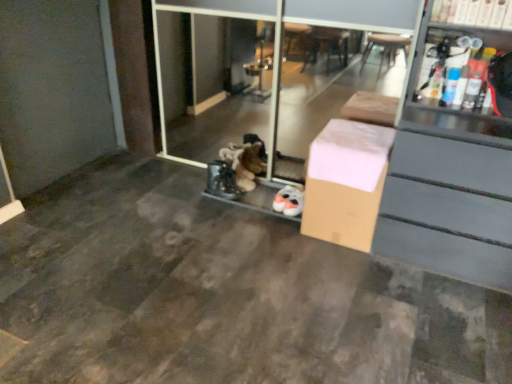
What do you see at coordinates (274, 70) in the screenshot? This screenshot has width=512, height=384. I see `transparent glass screen door at center` at bounding box center [274, 70].

I want to click on white cardboard box at upper right, so click(x=474, y=13).

Is transparent glass screen door at center placed right next to brown cardboard box at center?

No, transparent glass screen door at center is not with brown cardboard box at center.

Considering the relative sizes of transparent glass screen door at center and brown cardboard box at center in the image provided, is transparent glass screen door at center shorter than brown cardboard box at center?

No.

Would you say transparent glass screen door at center is inside or outside brown cardboard box at center?

transparent glass screen door at center cannot be found inside brown cardboard box at center.

Can you tell me how much brown cardboard box at center and transparent glass screen door at center differ in facing direction?

The angular difference between brown cardboard box at center and transparent glass screen door at center is 0.748 degrees.

Considering the relative sizes of brown cardboard box at center and transparent glass screen door at center in the image provided, is brown cardboard box at center thinner than transparent glass screen door at center?

No, brown cardboard box at center is not thinner than transparent glass screen door at center.

Considering the relative positions of brown cardboard box at center and transparent glass screen door at center in the image provided, is brown cardboard box at center to the left of transparent glass screen door at center from the viewer's perspective?

No.

Is transparent glass screen door at center inside brown cardboard box at center?

No, brown cardboard box at center does not contain transparent glass screen door at center.

Does transparent glass screen door at center turn towards white cardboard box at upper right?

No, transparent glass screen door at center is not oriented towards white cardboard box at upper right.

Consider the image. Is transparent glass screen door at center bigger than white cardboard box at upper right?

Indeed, transparent glass screen door at center has a larger size compared to white cardboard box at upper right.

Choose the correct answer: Is transparent glass screen door at center inside white cardboard box at upper right or outside it?

transparent glass screen door at center lies outside white cardboard box at upper right.

Are transparent glass screen door at center and white cardboard box at upper right located far from each other?

transparent glass screen door at center is positioned a significant distance from white cardboard box at upper right.

Which is in front, point (442, 18) or point (369, 147)?

The point (442, 18) is in front.

Considering the relative sizes of white cardboard box at upper right and brown cardboard box at center in the image provided, is white cardboard box at upper right bigger than brown cardboard box at center?

No.

Considering the sizes of white cardboard box at upper right and brown cardboard box at center in the image, is white cardboard box at upper right taller or shorter than brown cardboard box at center?

Clearly, white cardboard box at upper right is shorter compared to brown cardboard box at center.

Considering the relative positions of white cardboard box at upper right and transparent glass screen door at center in the image provided, is white cardboard box at upper right behind transparent glass screen door at center?

No, white cardboard box at upper right is closer to the camera.

Considering the sizes of white cardboard box at upper right and transparent glass screen door at center in the image, is white cardboard box at upper right taller or shorter than transparent glass screen door at center?

white cardboard box at upper right is shorter than transparent glass screen door at center.

This screenshot has height=384, width=512. I want to click on shelf that is above the transparent glass screen door at center (from a real-world perspective), so click(474, 13).

Is transparent glass screen door at center inside white cardboard box at upper right?

No, white cardboard box at upper right does not contain transparent glass screen door at center.

In the scene shown: Is brown cardboard box at center next to white cardboard box at upper right?

No, brown cardboard box at center is not making contact with white cardboard box at upper right.

In the image, is brown cardboard box at center positioned in front of or behind white cardboard box at upper right?

Visually, brown cardboard box at center is located behind white cardboard box at upper right.

Between brown cardboard box at center and white cardboard box at upper right, which one has larger width?

brown cardboard box at center is wider.

From a real-world perspective, who is located lower, brown cardboard box at center or white cardboard box at upper right?

brown cardboard box at center.

Identify the location of screen door above the brown cardboard box at center (from a real-world perspective). (274, 70).

You are a GUI agent. You are given a task and a screenshot of the screen. Output one action in this format:
    pyautogui.click(x=<x>, y=<y>)
    Task: Click on the screen door that is above the brown cardboard box at center (from the image's perspective)
    This screenshot has width=512, height=384.
    Given the screenshot: What is the action you would take?
    pyautogui.click(x=274, y=70)

From the image, which object appears to be nearer to transparent glass screen door at center, white cardboard box at upper right or brown cardboard box at center?

brown cardboard box at center lies closer to transparent glass screen door at center than the other object.

Based on their spatial positions, is transparent glass screen door at center or brown cardboard box at center further from white cardboard box at upper right?

transparent glass screen door at center.

Considering their positions, is transparent glass screen door at center positioned closer to brown cardboard box at center than white cardboard box at upper right?

white cardboard box at upper right is positioned closer to the anchor brown cardboard box at center.

Based on their spatial positions, is brown cardboard box at center or white cardboard box at upper right further from transparent glass screen door at center?

The object further to transparent glass screen door at center is white cardboard box at upper right.

When comparing their distances from white cardboard box at upper right, does brown cardboard box at center or transparent glass screen door at center seem further?

transparent glass screen door at center.

In the scene shown: Estimate the real-world distances between objects in this image. Which object is further from brown cardboard box at center, white cardboard box at upper right or transparent glass screen door at center?

Based on the image, transparent glass screen door at center appears to be further to brown cardboard box at center.

Find the location of a particular element. Image resolution: width=512 pixels, height=384 pixels. box between transparent glass screen door at center and white cardboard box at upper right from left to right is located at coordinates (346, 182).